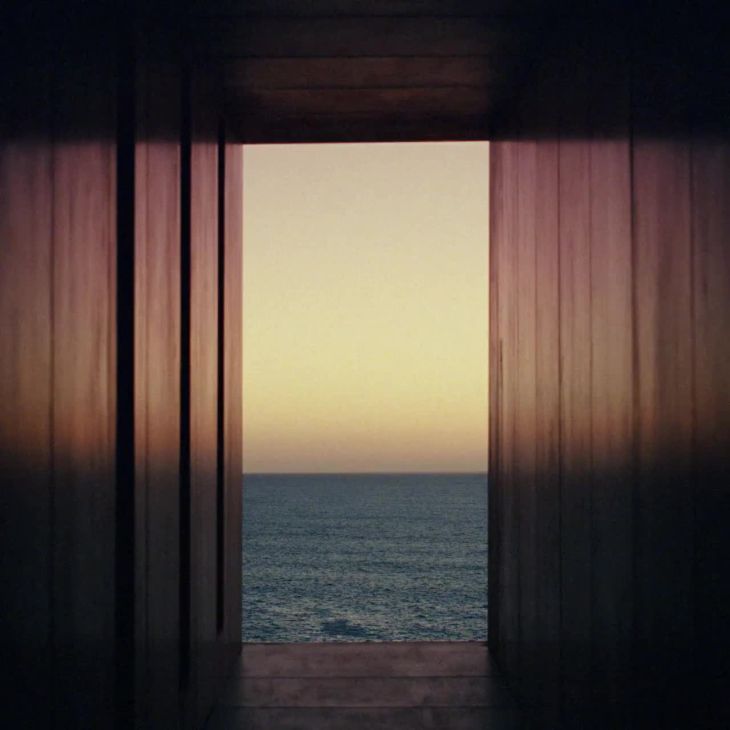
In order to click on right side of wall in this screenshot , I will do `click(655, 425)`.